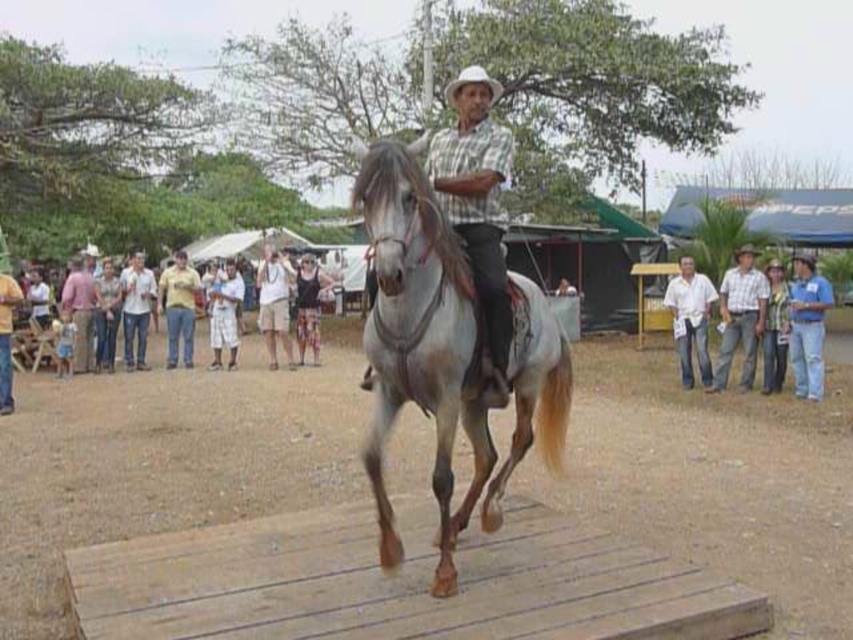
Does light brown cotton pants at center have a greater height compared to plaid shirt at right?

Incorrect, light brown cotton pants at center's height is not larger of plaid shirt at right's.

Locate an element on the screen. light brown cotton pants at center is located at coordinates (102, 314).

Locate an element on the screen. The height and width of the screenshot is (640, 853). light brown cotton pants at center is located at coordinates (102, 314).

Which of these two, white cotton shirt at right or black tank top at center, stands taller?

white cotton shirt at right is taller.

Between white cotton shirt at right and black tank top at center, which one is positioned higher?

black tank top at center is above.

What are the coordinates of `white cotton shirt at right` in the screenshot? It's located at (689, 320).

Is plaid shirt at right further to camera compared to white cotton shirt at right?

That is False.

Consider the image. Does plaid shirt at right appear over white cotton shirt at right?

Indeed, plaid shirt at right is positioned over white cotton shirt at right.

Locate an element on the screen. The height and width of the screenshot is (640, 853). plaid shirt at right is located at coordinates (740, 317).

This screenshot has width=853, height=640. Identify the location of plaid shirt at right. (740, 317).